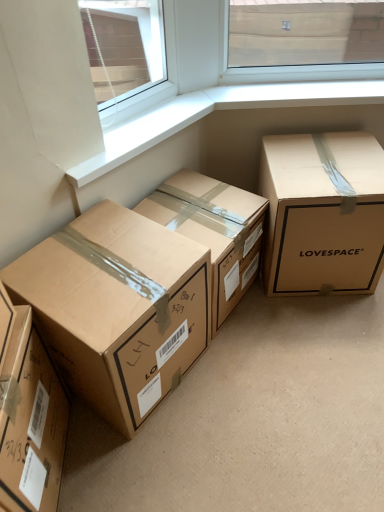
Question: From a real-world perspective, is brown cardboard box at center, which appears as the 2th box when viewed from the right, physically below matte cardboard box at right, the fourth box in the left-to-right sequence?

Choices:
 (A) yes
 (B) no

Answer: (A)

Question: From the image's perspective, is brown cardboard box at center, which is counted as the third box, starting from the left, located beneath matte cardboard box at right, the fourth box in the left-to-right sequence?

Choices:
 (A) yes
 (B) no

Answer: (A)

Question: Does brown cardboard box at center, which appears as the 2th box when viewed from the right, have a lesser width compared to matte cardboard box at right, the fourth box in the left-to-right sequence?

Choices:
 (A) yes
 (B) no

Answer: (A)

Question: Could you tell me if brown cardboard box at center, which appears as the 2th box when viewed from the right, is facing matte cardboard box at right, which is counted as the 1th box, starting from the right?

Choices:
 (A) no
 (B) yes

Answer: (A)

Question: Is the surface of brown cardboard box at center, which appears as the 2th box when viewed from the right, in direct contact with matte cardboard box at right, which is counted as the 1th box, starting from the right?

Choices:
 (A) yes
 (B) no

Answer: (B)

Question: In terms of size, does brown cardboard box at center, which appears as the 2th box when viewed from the right, appear bigger or smaller than brown cardboard box at lower left, the first box viewed from the left?

Choices:
 (A) big
 (B) small

Answer: (A)

Question: Does point (180, 197) appear closer or farther from the camera than point (11, 440)?

Choices:
 (A) farther
 (B) closer

Answer: (A)

Question: Considering the positions of brown cardboard box at center, which is counted as the third box, starting from the left, and brown cardboard box at lower left, the first box viewed from the left, in the image, is brown cardboard box at center, which is counted as the third box, starting from the left, wider or thinner than brown cardboard box at lower left, the first box viewed from the left,?

Choices:
 (A) wide
 (B) thin

Answer: (A)

Question: From the image's perspective, is brown cardboard box at center, which appears as the 2th box when viewed from the right, located above or below brown cardboard box at lower left, the first box viewed from the left?

Choices:
 (A) above
 (B) below

Answer: (A)

Question: From a real-world perspective, is white smooth window sill at upper center above or below brown cardboard box at center, which appears as the 2th box when viewed from the right?

Choices:
 (A) above
 (B) below

Answer: (A)

Question: Is white smooth window sill at upper center taller or shorter than brown cardboard box at center, which is counted as the third box, starting from the left?

Choices:
 (A) short
 (B) tall

Answer: (A)

Question: Based on their positions, is white smooth window sill at upper center located to the left or right of brown cardboard box at center, which is counted as the third box, starting from the left?

Choices:
 (A) left
 (B) right

Answer: (A)

Question: Is white smooth window sill at upper center wider or thinner than brown cardboard box at center, which is counted as the third box, starting from the left?

Choices:
 (A) thin
 (B) wide

Answer: (A)

Question: Is matte cardboard box at right, the fourth box in the left-to-right sequence, taller or shorter than white smooth window sill at upper center?

Choices:
 (A) tall
 (B) short

Answer: (A)

Question: In terms of width, does matte cardboard box at right, which is counted as the 1th box, starting from the right, look wider or thinner when compared to white smooth window sill at upper center?

Choices:
 (A) thin
 (B) wide

Answer: (B)